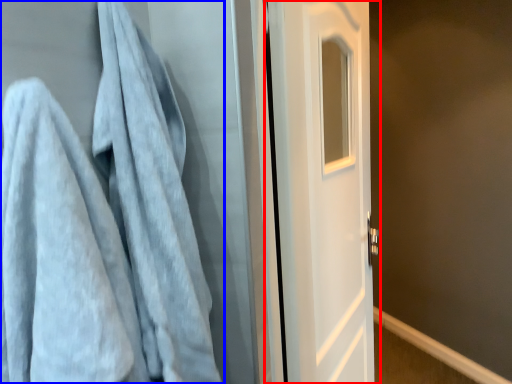
Question: Which of the following is the farthest to the observer, door (highlighted by a red box) or towel (highlighted by a blue box)?

Choices:
 (A) door
 (B) towel

Answer: (A)